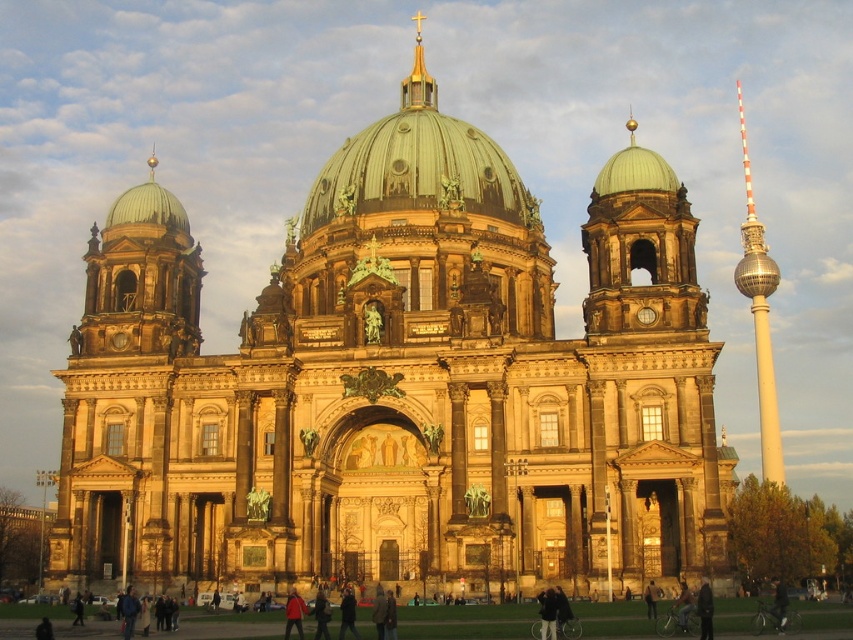
Is point (370, 138) farther from camera compared to point (419, 76)?

No, (370, 138) is in front of (419, 76).

Locate an element on the screen. This screenshot has height=640, width=853. green metallic dome at center is located at coordinates (418, 164).

Does green metallic dome at center come behind silver metallic tower at right?

No, it is not.

Who is higher up, green metallic dome at center or silver metallic tower at right?

green metallic dome at center is higher up.

The width and height of the screenshot is (853, 640). Find the location of `green metallic dome at center`. green metallic dome at center is located at coordinates (418, 164).

Does green copper dome at upper center appear on the left side of silver metallic tower at right?

Yes, green copper dome at upper center is to the left of silver metallic tower at right.

What do you see at coordinates (640, 246) in the screenshot?
I see `green copper dome at upper center` at bounding box center [640, 246].

The width and height of the screenshot is (853, 640). What are the coordinates of `green copper dome at upper center` in the screenshot? It's located at (640, 246).